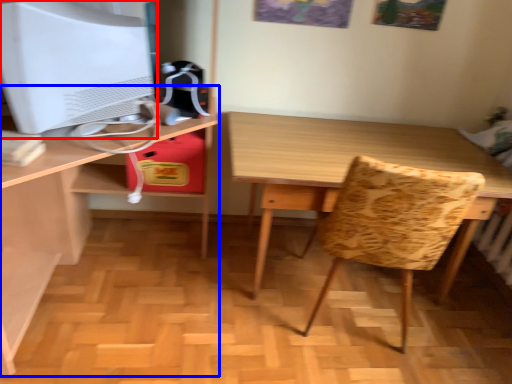
Question: Which object appears farthest to the camera in this image, computer monitor (highlighted by a red box) or desk (highlighted by a blue box)?

Choices:
 (A) computer monitor
 (B) desk

Answer: (A)